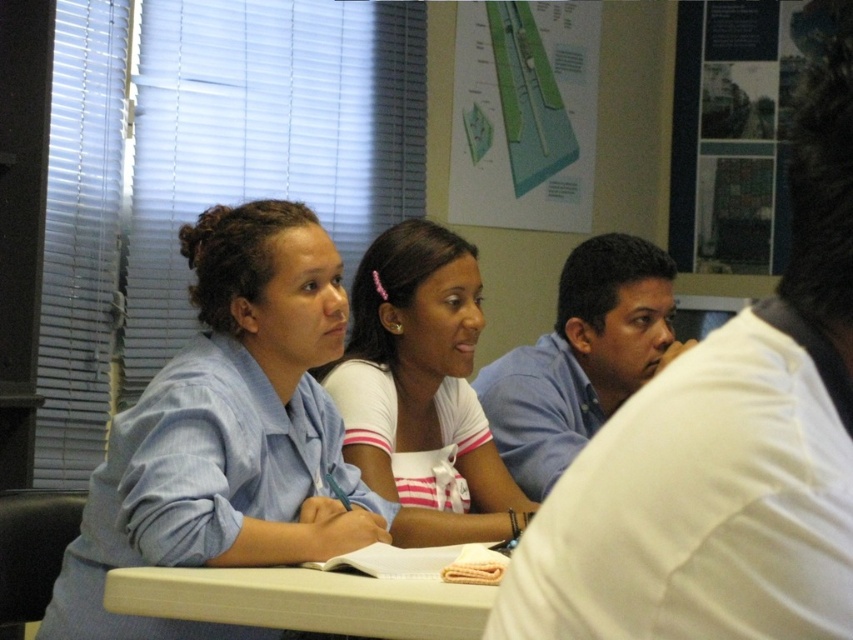
You are attending a meeting in a room with blinds that have horizontal slats. You notice two people wearing blue shirts. The blue shirt at center and the blue striped shirt at upper left. Which of the two blue shirts is positioned to the right side of the other?

The blue shirt at center is to the right of the blue striped shirt at upper left.

You are sitting at the table in the classroom scene. You want to pass a note to the person wearing the blue striped shirt at upper left. Since you are at the white plastic table at lower center, can you reach them directly without moving around the table?

The white plastic table at lower center is behind the blue striped shirt at upper left, so you would need to move around the table to reach them directly.